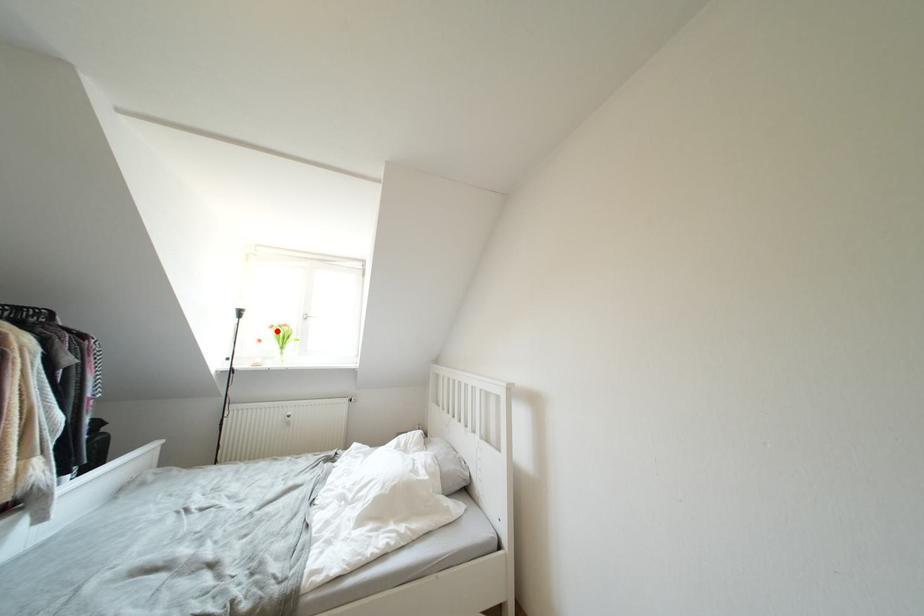
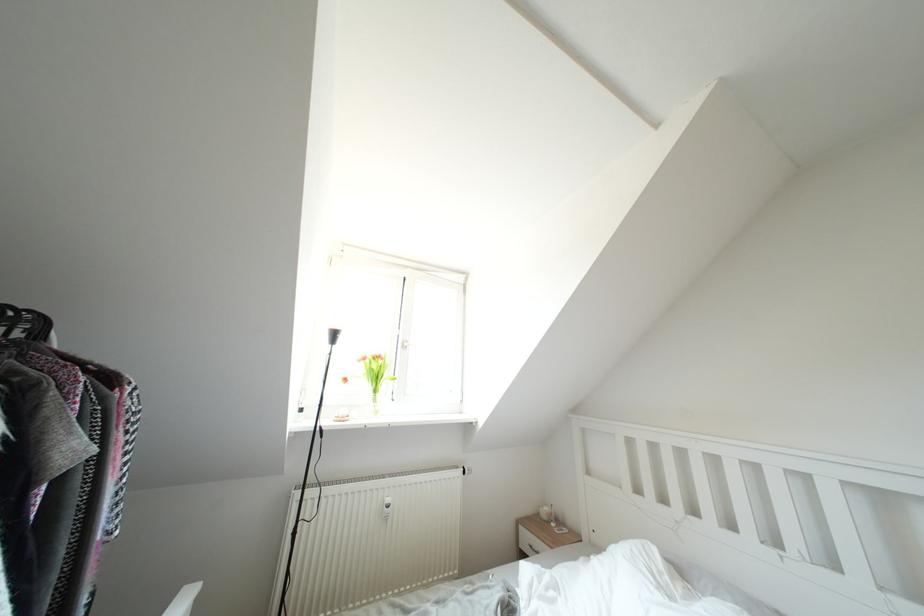
Where in the second image is the point corresponding to the highlighted location from the first image?

(370, 363)